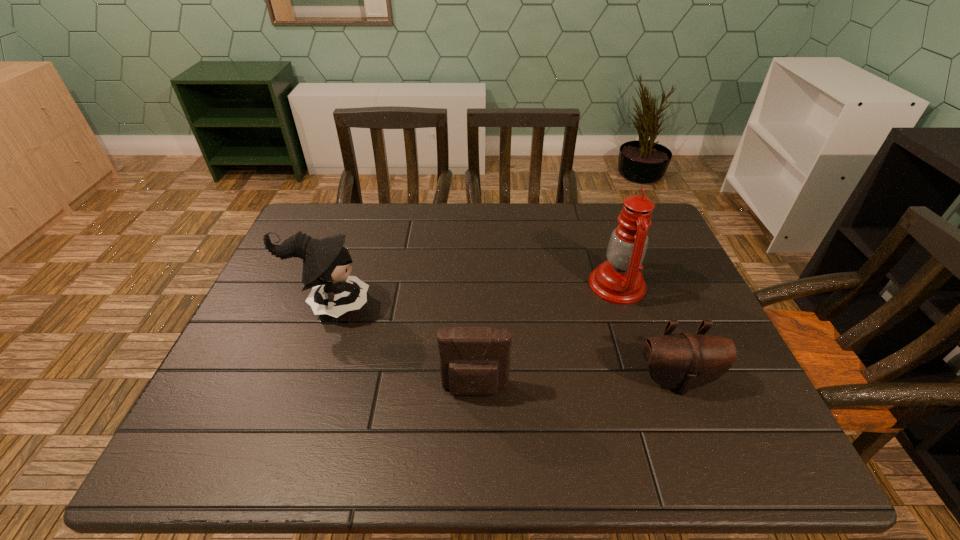
Locate an element on the screen. the tallest object is located at coordinates (619, 280).

The height and width of the screenshot is (540, 960). In order to click on the leftmost object in this screenshot , I will do `click(326, 262)`.

Where is `the third shortest object`? the third shortest object is located at coordinates (326, 262).

Find the location of a particular element. This screenshot has width=960, height=540. the third object from right to left is located at coordinates (474, 361).

You are a GUI agent. You are given a task and a screenshot of the screen. Output one action in this format:
    pyautogui.click(x=<x>, y=<y>)
    Task: Click on the right pouch
    
    Given the screenshot: What is the action you would take?
    pyautogui.click(x=683, y=361)

Where is `blank space located 0.070m on the back of the tallest object`? The image size is (960, 540). blank space located 0.070m on the back of the tallest object is located at coordinates (605, 249).

You are a GUI agent. You are given a task and a screenshot of the screen. Output one action in this format:
    pyautogui.click(x=<x>, y=<y>)
    Task: Click on the vacant point located at the face of the second tallest object
    This screenshot has height=540, width=960.
    Given the screenshot: What is the action you would take?
    pyautogui.click(x=402, y=305)

Where is `free space located 0.070m with an open flap on the second object from left to right`? The width and height of the screenshot is (960, 540). free space located 0.070m with an open flap on the second object from left to right is located at coordinates (474, 434).

What are the coordinates of `free location located with the flap open on the right pouch` in the screenshot? It's located at (691, 419).

In order to click on object that is positioned at the left edge in this screenshot , I will do `click(326, 262)`.